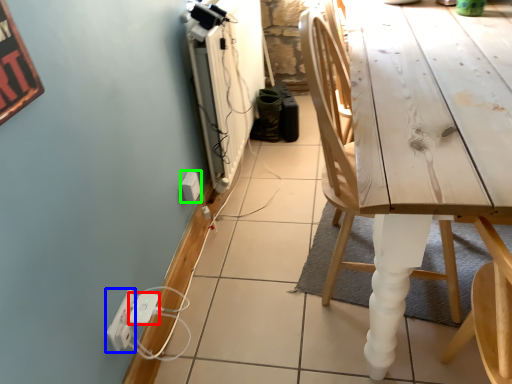
Question: Which object is positioned closest to extension cord (highlighted by a red box)? Select from electric outlet (highlighted by a blue box) and electric outlet (highlighted by a green box).

Choices:
 (A) electric outlet
 (B) electric outlet

Answer: (A)